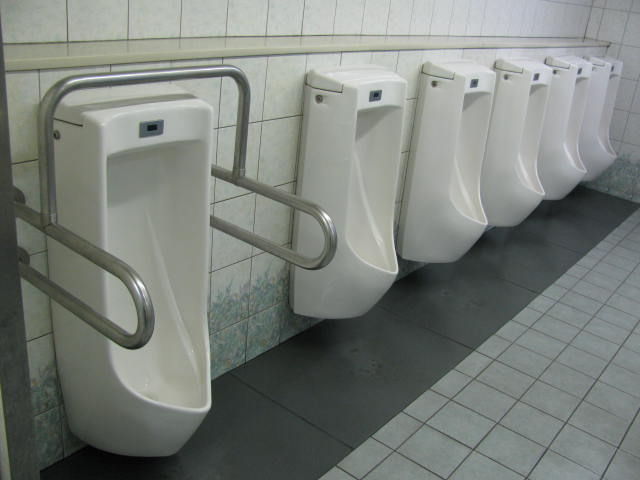
The width and height of the screenshot is (640, 480). Find the location of `mens bath room`. mens bath room is located at coordinates (164, 110), (347, 96), (452, 83), (529, 69), (572, 69), (602, 69).